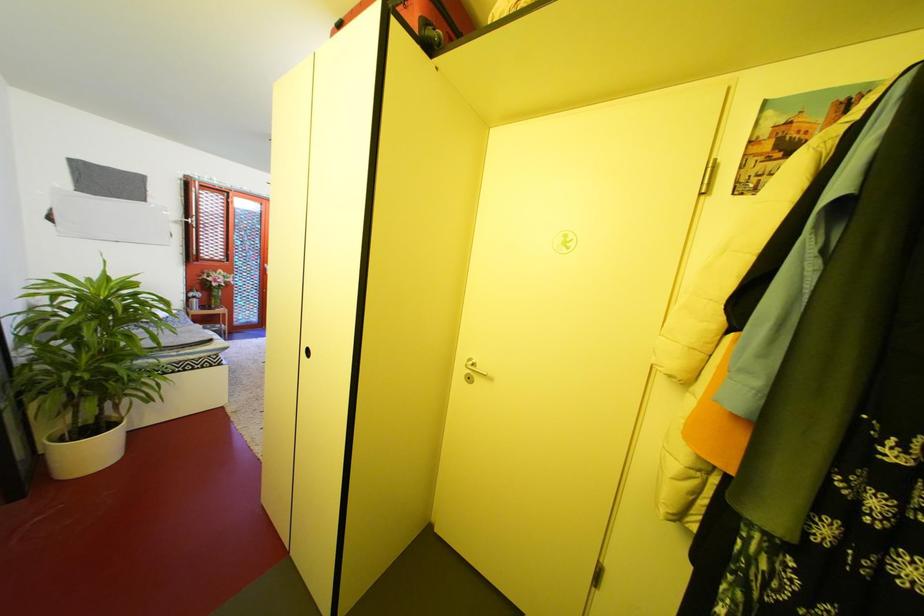
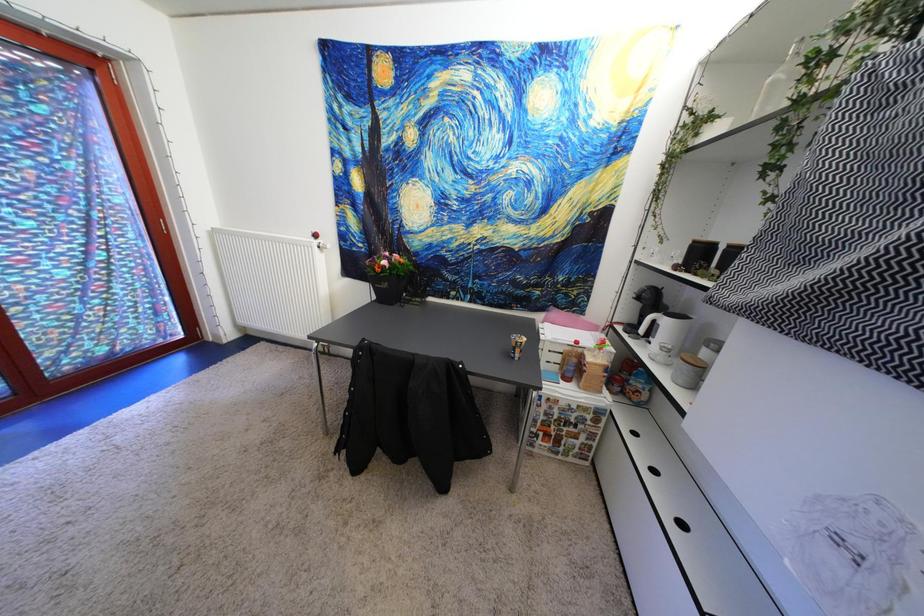
In a continuous first-person perspective shot, in which direction is the camera moving?

The cameraman walked toward left, forward.